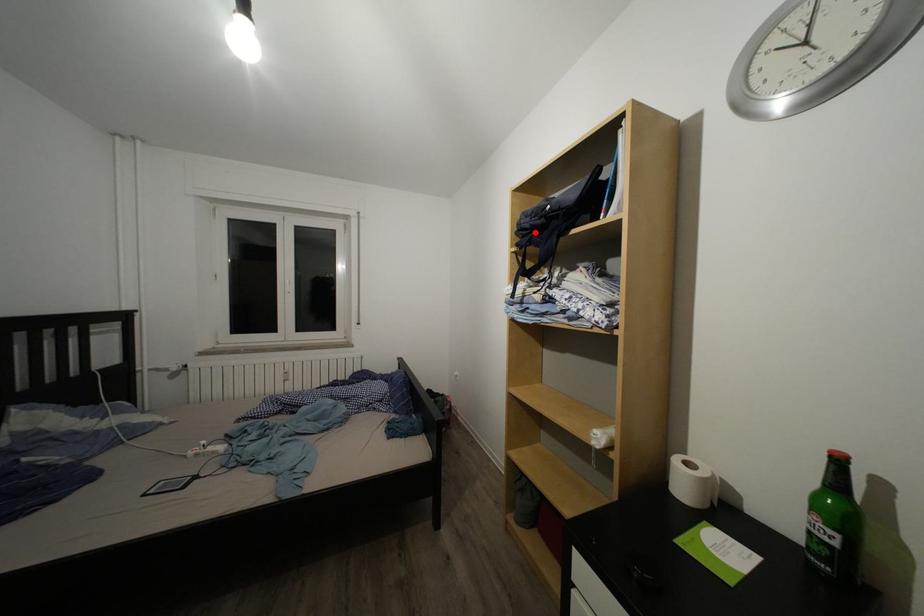
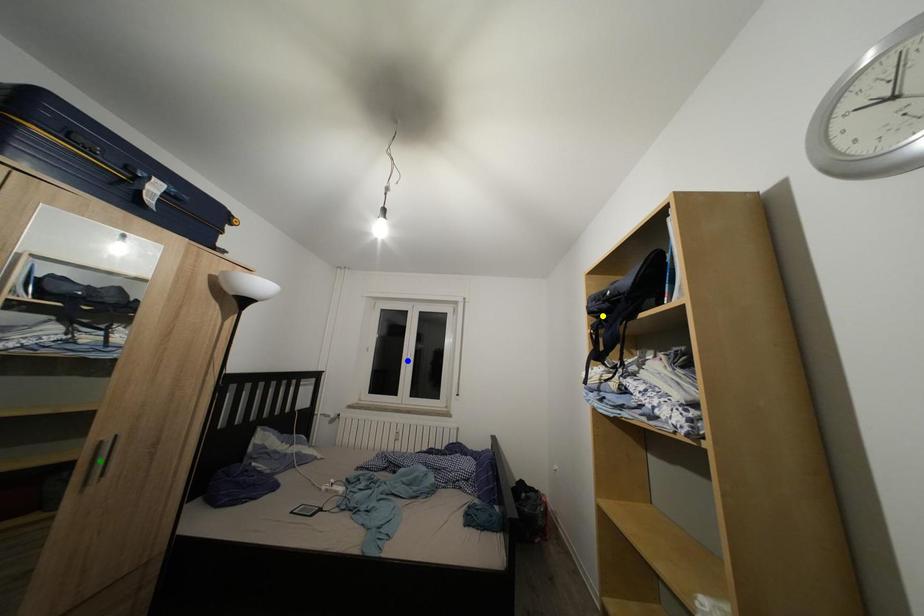
Question: I am providing you with two images of the same scene from different viewpoints. A red point is marked on the first image. You are given multiple points on the second image. In image 2, which mark is for the same physical point as the one in image 1?

Choices:
 (A) green point
 (B) yellow point
 (C) blue point

Answer: (B)